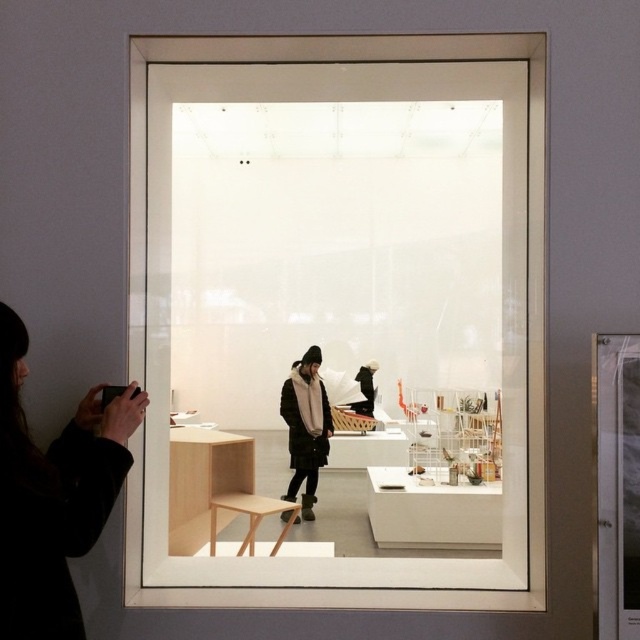
Question: Which point is closer to the camera?

Choices:
 (A) click(292, 433)
 (B) click(236, 497)
 (C) click(483, 65)

Answer: (C)

Question: Which object appears farthest from the camera in this image?

Choices:
 (A) black woolen coat at center
 (B) light wood bench at center

Answer: (A)

Question: Does light wood bench at center appear over black woolen coat at center?

Choices:
 (A) no
 (B) yes

Answer: (B)

Question: Estimate the real-world distances between objects in this image. Which object is farther from the light wood bench at center?

Choices:
 (A) black fabric at left
 (B) light brown wooden stool at center

Answer: (B)

Question: Does light wood bench at center appear under light brown wooden stool at center?

Choices:
 (A) no
 (B) yes

Answer: (A)

Question: Where is light wood bench at center located in relation to black fabric at left in the image?

Choices:
 (A) below
 (B) above

Answer: (B)